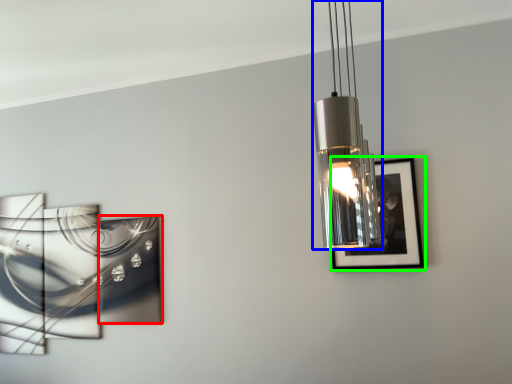
Question: Based on their relative distances, which object is farther from picture frame (highlighted by a red box)? Choose from lamp (highlighted by a blue box) and picture frame (highlighted by a green box).

Choices:
 (A) lamp
 (B) picture frame

Answer: (A)